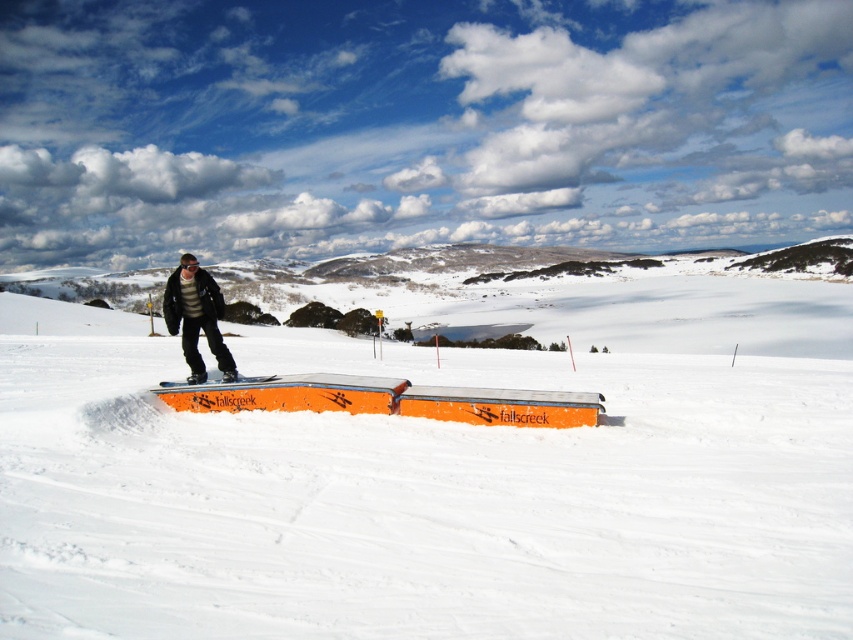
You are a photographer positioned at the bottom of the snow ramp labeled Falls Creek. You want to capture a photo where both the white smooth snow at center and the orange matte snowboard at center are clearly visible. Which object should you focus on first to ensure both are in sharp focus?

You should focus on the white smooth snow at center first because it is closer to the viewer than the orange matte snowboard at center. By focusing on the closer object, the snowboard will also be in focus due to the depth of field.

You are a winter sports enthusiast planning to jump off the snow ramp labeled Falls Creek. You notice the white smooth snow at center and the matte black jacket at center. Which object is higher in elevation?

The white smooth snow at center is much taller than the matte black jacket at center, so the white smooth snow at center is higher in elevation.